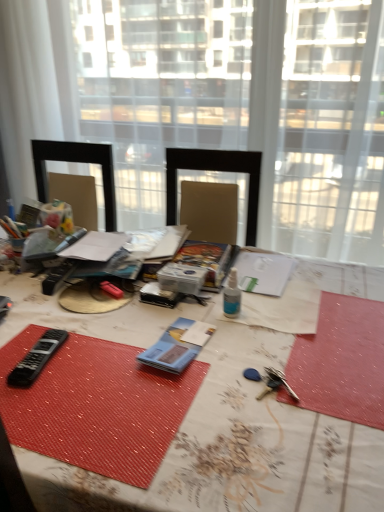
Question: Can you confirm if blue paper at center, the first equipment when ordered from right to left, is shorter than white textured table at center?

Choices:
 (A) no
 (B) yes

Answer: (B)

Question: Is blue paper at center, which is the second equipment in left-to-right order, to the right of white textured table at center from the viewer's perspective?

Choices:
 (A) yes
 (B) no

Answer: (A)

Question: Is blue paper at center, which is the second equipment in left-to-right order, outside white textured table at center?

Choices:
 (A) no
 (B) yes

Answer: (A)

Question: Is blue paper at center, the first equipment when ordered from right to left, bigger than white textured table at center?

Choices:
 (A) no
 (B) yes

Answer: (A)

Question: Does blue paper at center, which is the second equipment in left-to-right order, have a greater height compared to white textured table at center?

Choices:
 (A) no
 (B) yes

Answer: (A)

Question: Is white textured table at center in front of or behind transparent glass window at center, acting as the 2th window starting from the left, in the image?

Choices:
 (A) front
 (B) behind

Answer: (A)

Question: Do you think white textured table at center is within transparent glass window at center, acting as the 2th window starting from the left, or outside of it?

Choices:
 (A) inside
 (B) outside

Answer: (B)

Question: Considering the positions of white textured table at center and transparent glass window at center, acting as the 2th window starting from the left, in the image, is white textured table at center taller or shorter than transparent glass window at center, acting as the 2th window starting from the left,?

Choices:
 (A) short
 (B) tall

Answer: (A)

Question: In the image, is white textured table at center on the left side or the right side of transparent glass window at center, which is the 1th window from right to left?

Choices:
 (A) left
 (B) right

Answer: (A)

Question: From a real-world perspective, relative to black plastic remote at lower left, the first equipment from the left, is transparent glass window at center, acting as the 2th window starting from the left, vertically above or below?

Choices:
 (A) above
 (B) below

Answer: (A)

Question: Considering the positions of transparent glass window at center, acting as the 2th window starting from the left, and black plastic remote at lower left, the first equipment from the left, in the image, is transparent glass window at center, acting as the 2th window starting from the left, wider or thinner than black plastic remote at lower left, the first equipment from the left,?

Choices:
 (A) wide
 (B) thin

Answer: (A)

Question: From the image's perspective, relative to black plastic remote at lower left, the second equipment positioned from the right, is transparent glass window at center, which is the 1th window from right to left, above or below?

Choices:
 (A) above
 (B) below

Answer: (A)

Question: In the image, is transparent glass window at center, acting as the 2th window starting from the left, positioned in front of or behind black plastic remote at lower left, the first equipment from the left?

Choices:
 (A) behind
 (B) front

Answer: (A)

Question: Is black plastic remote at lower left, the first equipment from the left, spatially inside blue paper at center, which is the second equipment in left-to-right order, or outside of it?

Choices:
 (A) outside
 (B) inside

Answer: (A)

Question: From the image's perspective, is black plastic remote at lower left, the second equipment positioned from the right, positioned above or below blue paper at center, which is the second equipment in left-to-right order?

Choices:
 (A) below
 (B) above

Answer: (A)